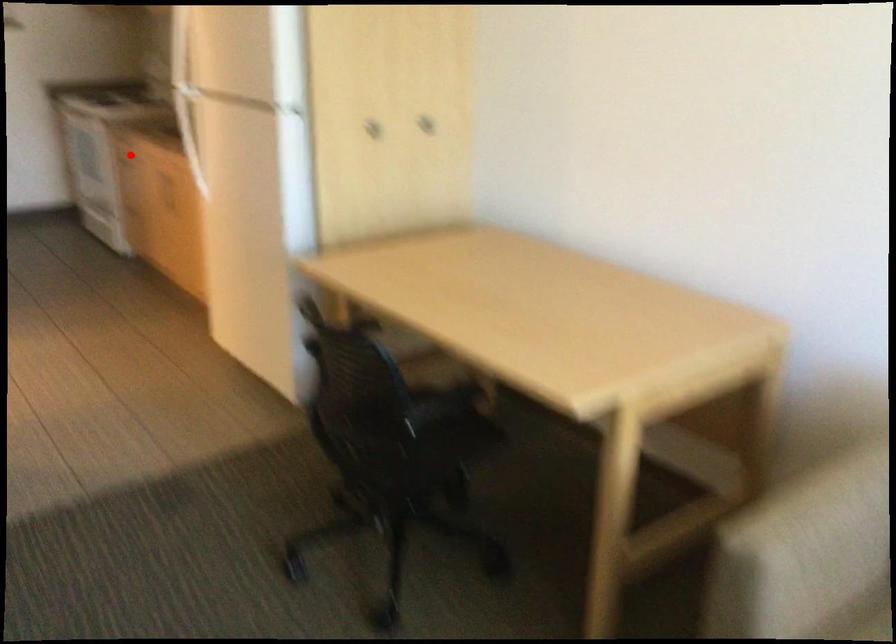
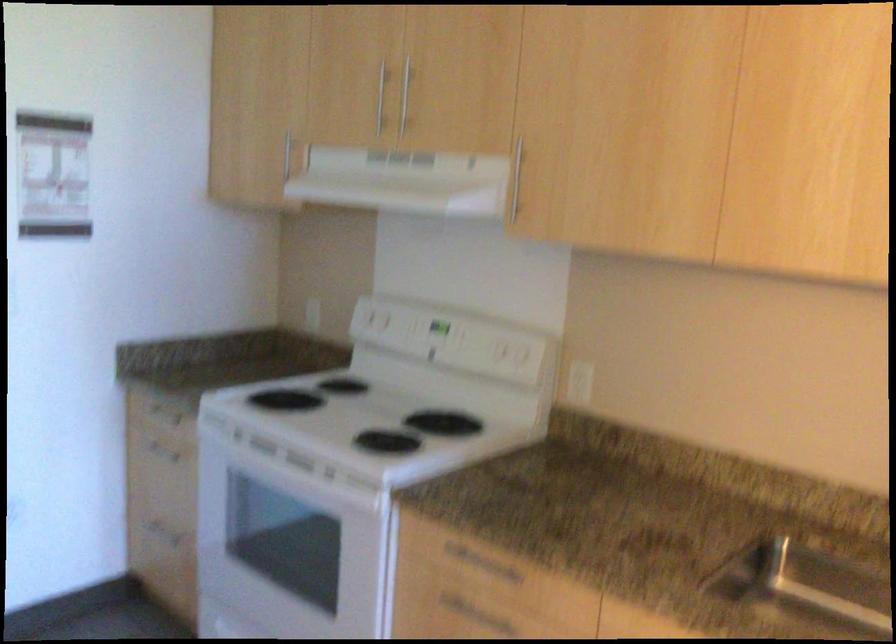
Where in the second image is the point corresponding to the highlighted location from the first image?

(385, 571)